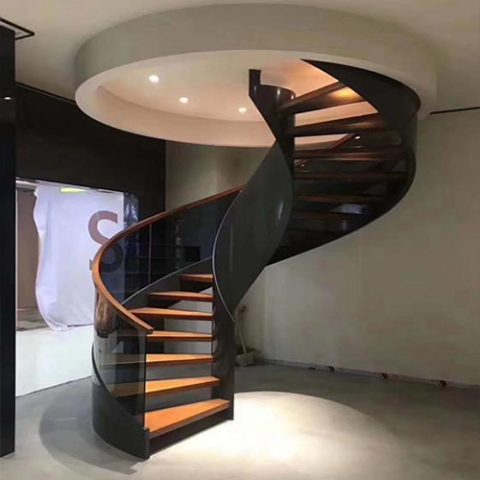
The image size is (480, 480). I want to click on bottommost wooden step, so click(189, 410).